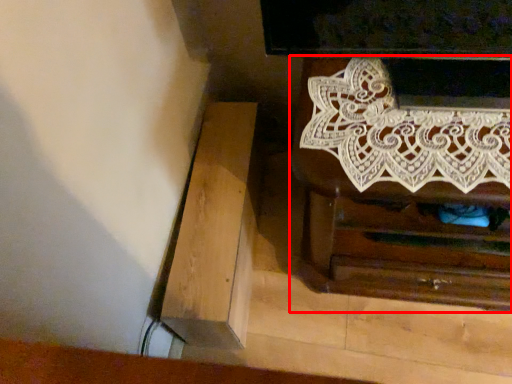
Question: Where is chest of drawers (annotated by the red box) located in relation to furniture in the image?

Choices:
 (A) right
 (B) left

Answer: (A)